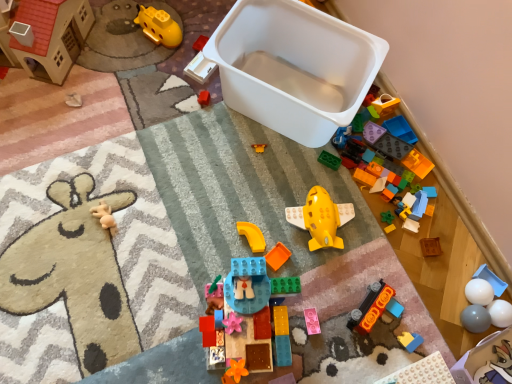
Where is `spots to the right of beige rubber bear at left, placed as the 2th toy when sorted from left to right`? Image resolution: width=512 pixels, height=384 pixels. spots to the right of beige rubber bear at left, placed as the 2th toy when sorted from left to right is located at coordinates (161, 229).